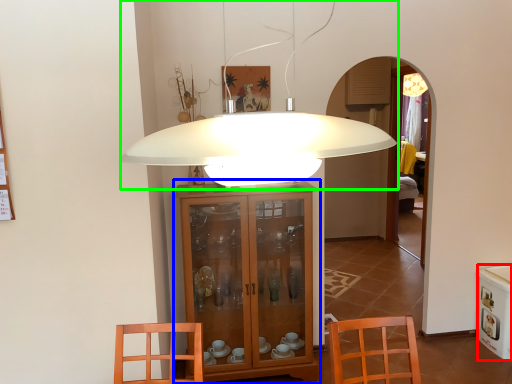
Question: Considering the real-world distances, which object is closest to appliance (highlighted by a red box)? cabinetry (highlighted by a blue box) or lamp (highlighted by a green box).

Choices:
 (A) cabinetry
 (B) lamp

Answer: (A)